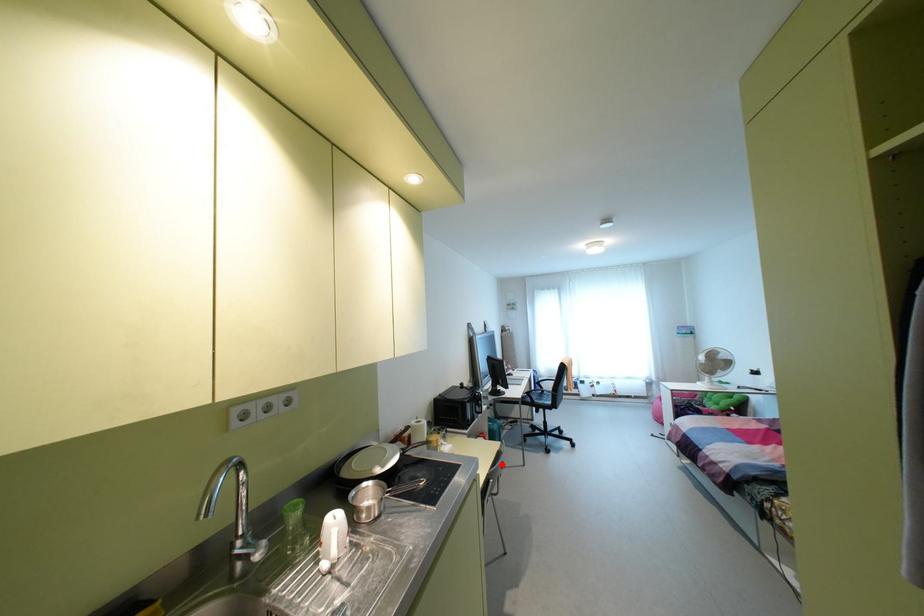
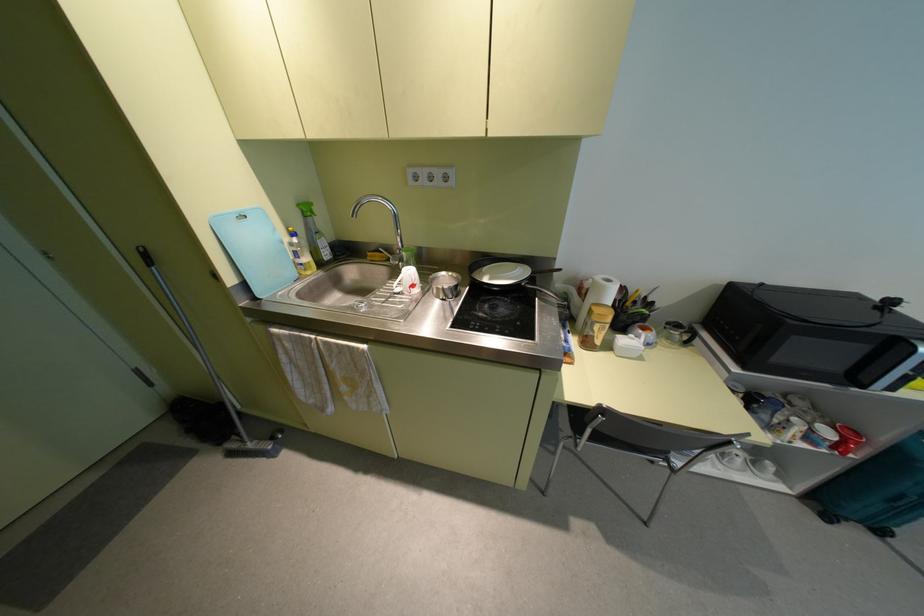
Where in the second image is the point corresponding to the highlighted location from the first image?

(880, 531)